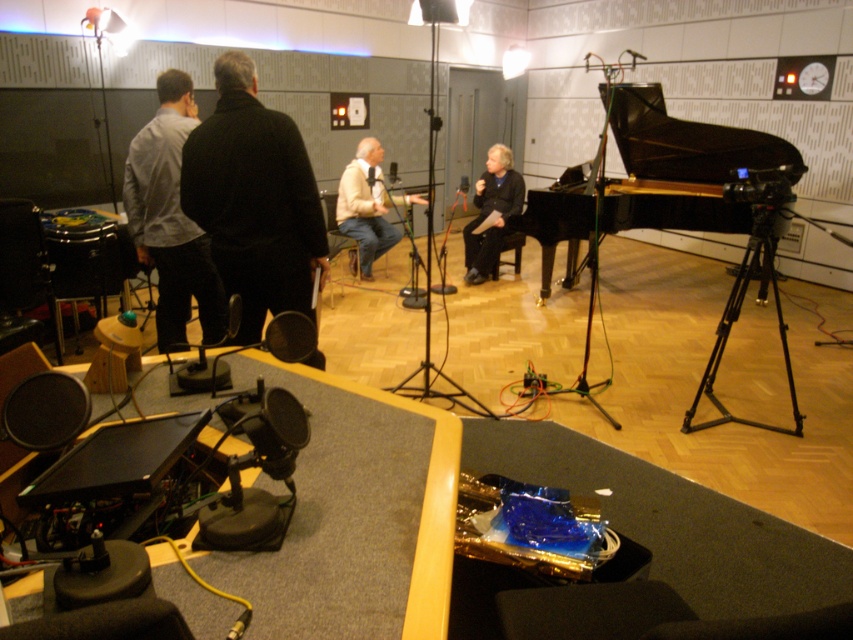
You are a sound engineer setting up equipment in the studio. You need to place a tall amplifier that requires 2 meters of vertical space. Based on the scene, which object between the black polished piano at center and the black metal tripod at right can accommodate this requirement?

The black polished piano at center is much taller than the black metal tripod at right. Since the piano is taller, it can accommodate the amplifier requiring 2 meters of vertical space.

Based on the photo, you are a stagehand in the recording studio and need to move a tall equipment case that is 1.8 meters in height. The case must be moved through the space between the black polished piano at center and the light gray fabric shirt at left. Can the equipment case pass through this space without being tilted?

The black polished piano at center is taller than the light gray fabric shirt at left. Since the equipment case is 1.8 meters tall, and the piano is taller than the shirt, the available vertical space between them would depend on their actual heights. However, since the piano is taller, there might not be enough clearance for the 1.8m case unless the shirt is positioned lower. Without specific height measurements, it is uncertain. But according to the description, the piano is taller, so the vertical gap is

You are standing in the recording studio and want to place a large amplifier next to the black polished piano at center. Based on the studio layout, where should you position the amplifier relative to the piano?

The black polished piano at center is located at point (682, 164), so you should position the amplifier near that coordinate to place it next to the piano.